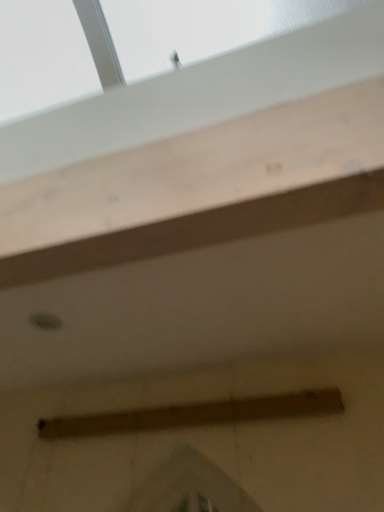
The width and height of the screenshot is (384, 512). Describe the element at coordinates (194, 414) in the screenshot. I see `brown matte plank at center` at that location.

The width and height of the screenshot is (384, 512). Identify the location of brown matte plank at center. (194, 414).

The width and height of the screenshot is (384, 512). I want to click on brown matte plank at center, so click(194, 414).